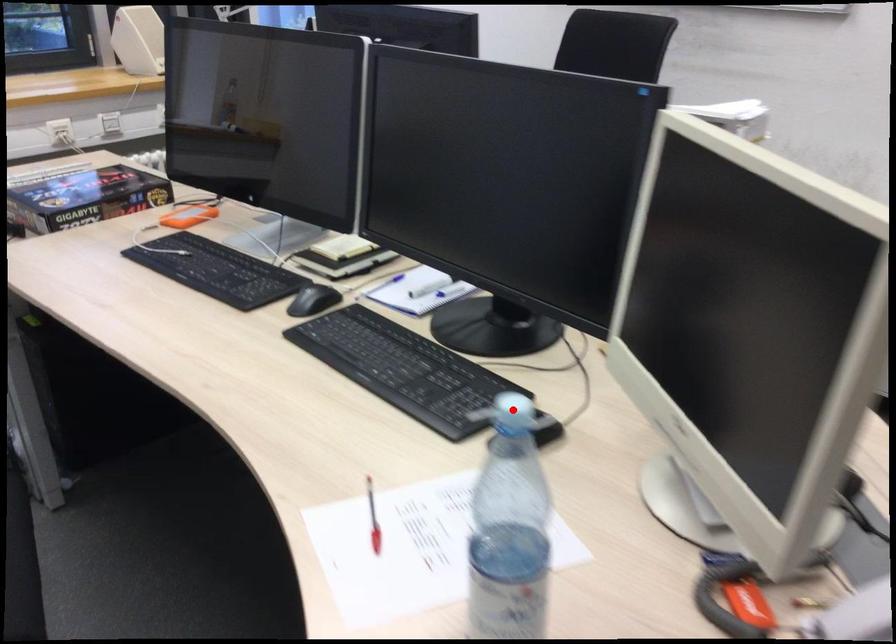
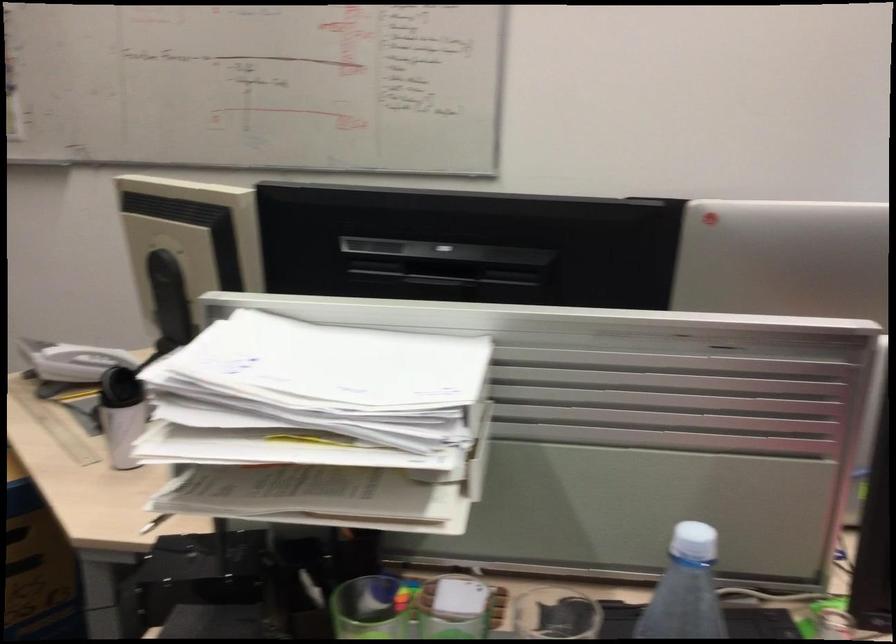
Question: I am providing you with two images of the same scene from different viewpoints. A red point is marked on the first image. At the location where the point appears in image 1, is it still visible in image 2?

Choices:
 (A) Yes
 (B) No

Answer: (B)